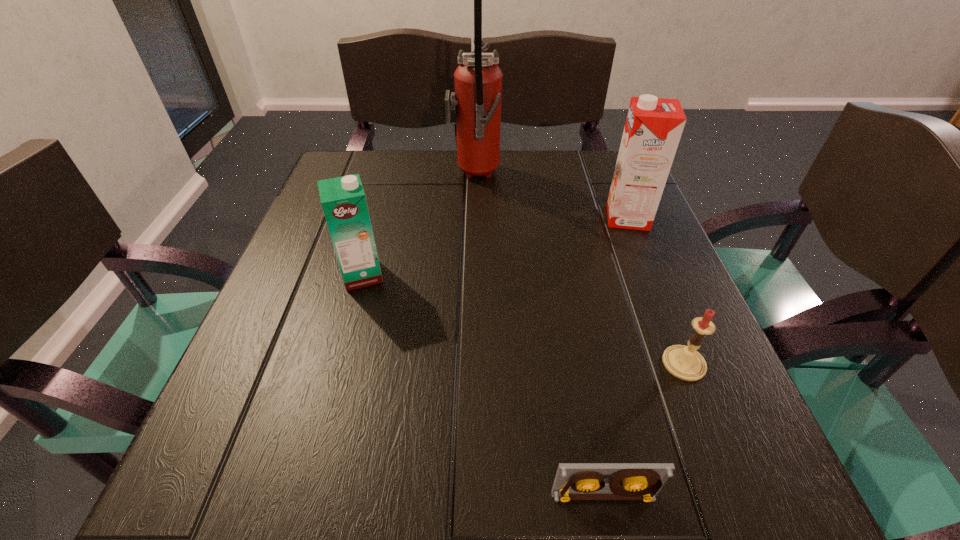
What are the coordinates of `free space that satisfies the following two spatial constraints: 1. on the front side of the candle; 2. on the left side of the leftmost object` in the screenshot? It's located at (338, 363).